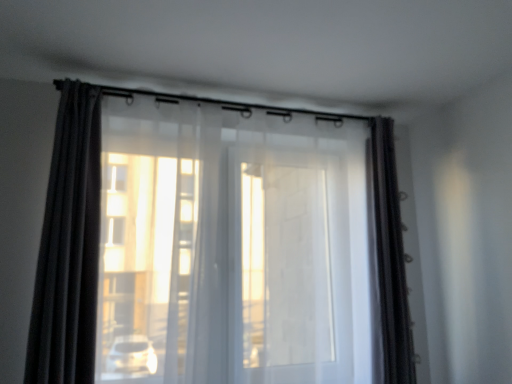
Question: Is transparent fabric curtain at center, the 2th curtain from the right, bigger or smaller than matte black curtain at left, the third curtain viewed from the right?

Choices:
 (A) big
 (B) small

Answer: (A)

Question: From the image's perspective, relative to matte black curtain at left, which is the first curtain from left to right, is transparent fabric curtain at center, which ranks as the second curtain in left-to-right order, above or below?

Choices:
 (A) above
 (B) below

Answer: (B)

Question: Estimate the real-world distances between objects in this image. Which object is closer to the satin dark brown curtain at right, the third curtain in the left-to-right sequence?

Choices:
 (A) matte black curtain at left, the third curtain viewed from the right
 (B) transparent fabric curtain at center, which ranks as the second curtain in left-to-right order

Answer: (B)

Question: Which is nearer to the matte black curtain at left, which is the first curtain from left to right?

Choices:
 (A) transparent fabric curtain at center, the 2th curtain from the right
 (B) satin dark brown curtain at right, which is the 1th curtain in right-to-left order

Answer: (A)